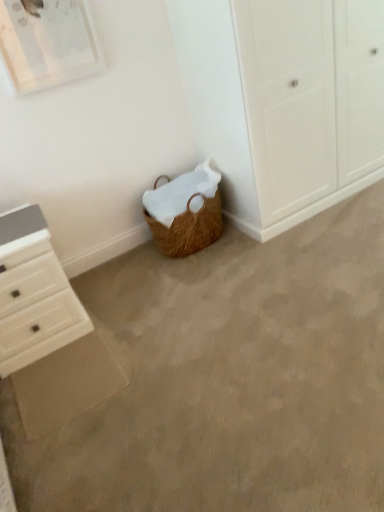
Question: Does braided wicker basket at lower center have a smaller size compared to white wood chest of drawers at lower left?

Choices:
 (A) no
 (B) yes

Answer: (A)

Question: Considering the relative positions of braided wicker basket at lower center and white wood chest of drawers at lower left in the image provided, is braided wicker basket at lower center to the left of white wood chest of drawers at lower left from the viewer's perspective?

Choices:
 (A) no
 (B) yes

Answer: (A)

Question: Could you tell me if braided wicker basket at lower center is turned towards white wood chest of drawers at lower left?

Choices:
 (A) yes
 (B) no

Answer: (B)

Question: From the image's perspective, is braided wicker basket at lower center located beneath white wood chest of drawers at lower left?

Choices:
 (A) yes
 (B) no

Answer: (A)

Question: Is braided wicker basket at lower center turned away from white wood chest of drawers at lower left?

Choices:
 (A) no
 (B) yes

Answer: (A)

Question: Does braided wicker basket at lower center have a lesser height compared to white wood chest of drawers at lower left?

Choices:
 (A) yes
 (B) no

Answer: (A)

Question: Is white wood chest of drawers at lower left oriented towards braided wicker basket at lower center?

Choices:
 (A) yes
 (B) no

Answer: (B)

Question: Can you confirm if white wood chest of drawers at lower left is smaller than braided wicker basket at lower center?

Choices:
 (A) no
 (B) yes

Answer: (B)

Question: From the image's perspective, does white wood chest of drawers at lower left appear higher than braided wicker basket at lower center?

Choices:
 (A) yes
 (B) no

Answer: (A)

Question: From a real-world perspective, is white wood chest of drawers at lower left under braided wicker basket at lower center?

Choices:
 (A) no
 (B) yes

Answer: (A)

Question: From the image's perspective, would you say white wood chest of drawers at lower left is shown under braided wicker basket at lower center?

Choices:
 (A) no
 (B) yes

Answer: (A)

Question: Does white wood chest of drawers at lower left have a greater height compared to braided wicker basket at lower center?

Choices:
 (A) no
 (B) yes

Answer: (B)

Question: In the image, is braided wicker basket at lower center positioned in front of or behind white wood chest of drawers at lower left?

Choices:
 (A) behind
 (B) front

Answer: (B)